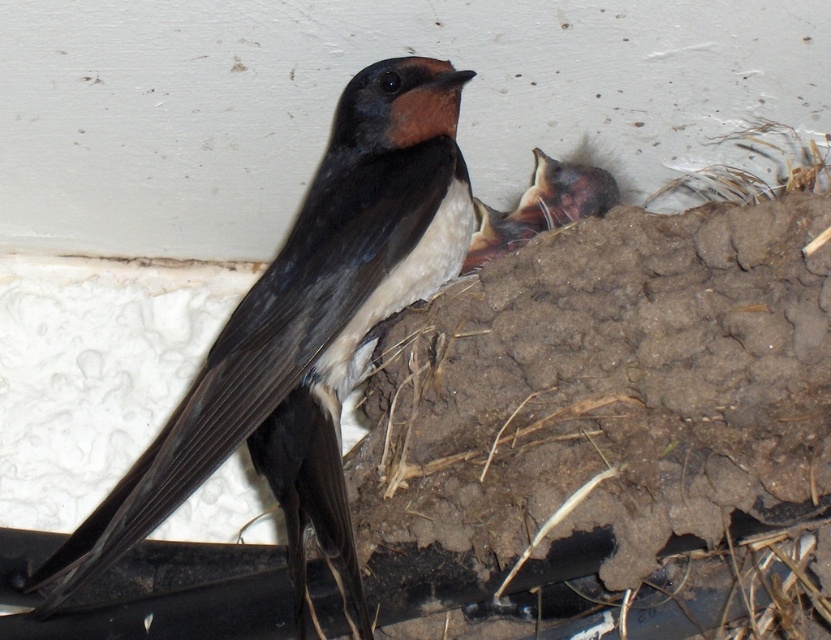
Question: Can you confirm if matte black bird at center is positioned above brown feathered bird at center?

Choices:
 (A) no
 (B) yes

Answer: (A)

Question: Does matte black bird at center have a lesser width compared to brown feathered bird at center?

Choices:
 (A) yes
 (B) no

Answer: (B)

Question: Which of the following is the farthest from the observer?

Choices:
 (A) brown feathered bird at center
 (B) matte black bird at center

Answer: (A)

Question: Does matte black bird at center appear on the left side of brown feathered bird at center?

Choices:
 (A) no
 (B) yes

Answer: (B)